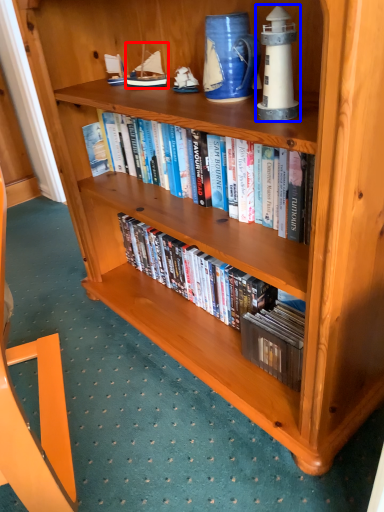
Question: Which point is closer to the camera, toy (highlighted by a red box) or toy (highlighted by a blue box)?

Choices:
 (A) toy
 (B) toy

Answer: (B)